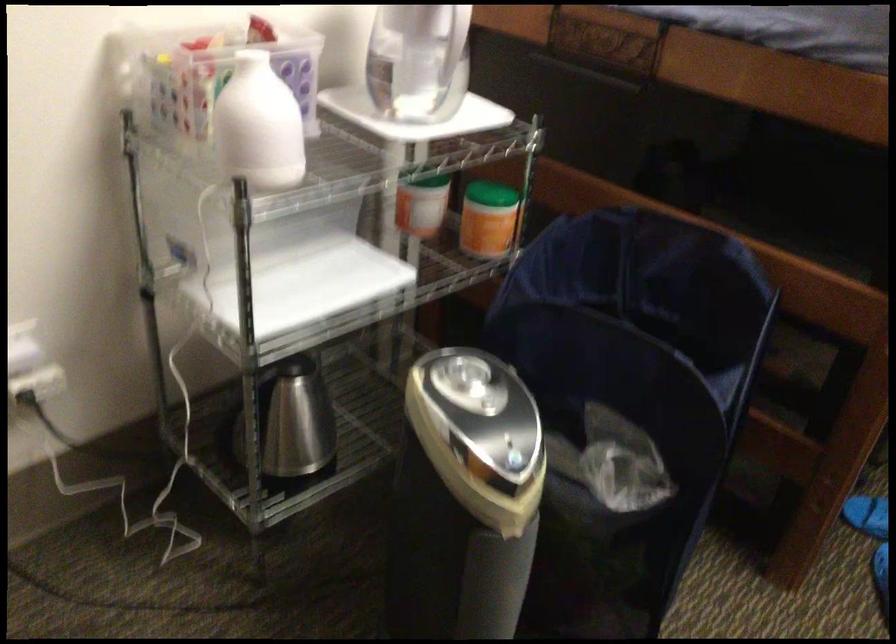
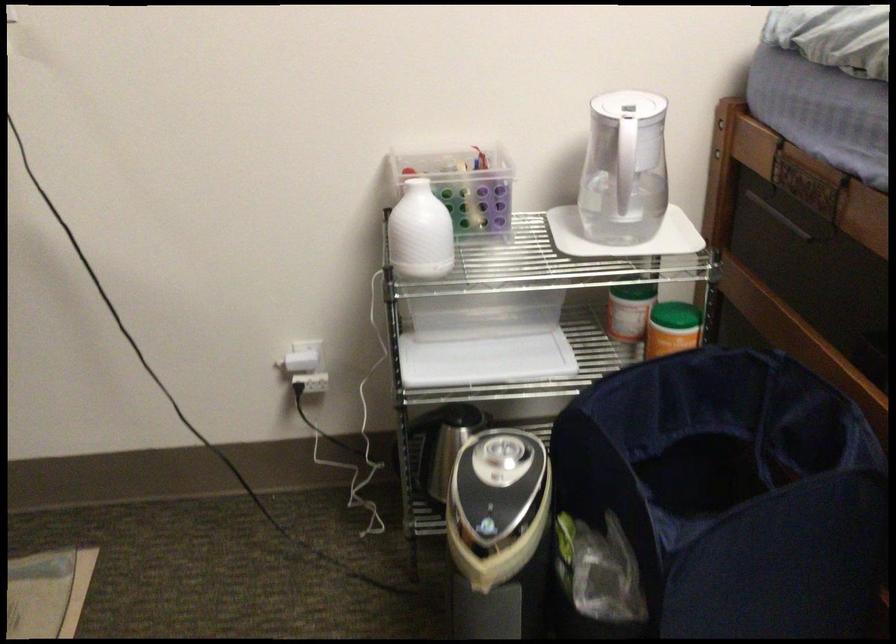
In the second image, find the point that corresponds to point (442, 216) in the first image.

(635, 325)